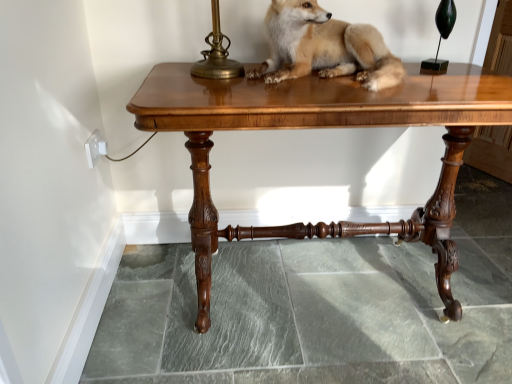
Question: From the image's perspective, is glossy wood table at center over light brown fur at center?

Choices:
 (A) yes
 (B) no

Answer: (B)

Question: Is glossy wood table at center wider than light brown fur at center?

Choices:
 (A) yes
 (B) no

Answer: (A)

Question: Is light brown fur at center completely or partially inside glossy wood table at center?

Choices:
 (A) yes
 (B) no

Answer: (B)

Question: Is glossy wood table at center to the left of light brown fur at center from the viewer's perspective?

Choices:
 (A) no
 (B) yes

Answer: (B)

Question: Can you confirm if glossy wood table at center is smaller than light brown fur at center?

Choices:
 (A) yes
 (B) no

Answer: (B)

Question: Does glossy wood table at center turn towards light brown fur at center?

Choices:
 (A) yes
 (B) no

Answer: (B)

Question: Is glossy wood table at center smaller than shiny brass table lamp at upper right?

Choices:
 (A) no
 (B) yes

Answer: (A)

Question: Can you confirm if glossy wood table at center is shorter than shiny brass table lamp at upper right?

Choices:
 (A) yes
 (B) no

Answer: (B)

Question: Is glossy wood table at center far from shiny brass table lamp at upper right?

Choices:
 (A) yes
 (B) no

Answer: (B)

Question: Is shiny brass table lamp at upper right at the back of glossy wood table at center?

Choices:
 (A) no
 (B) yes

Answer: (A)

Question: Is glossy wood table at center next to shiny brass table lamp at upper right?

Choices:
 (A) yes
 (B) no

Answer: (B)

Question: From a real-world perspective, does glossy wood table at center stand above shiny brass table lamp at upper right?

Choices:
 (A) no
 (B) yes

Answer: (A)

Question: Is shiny brass table lamp at upper right facing away from glossy wood table at center?

Choices:
 (A) yes
 (B) no

Answer: (B)